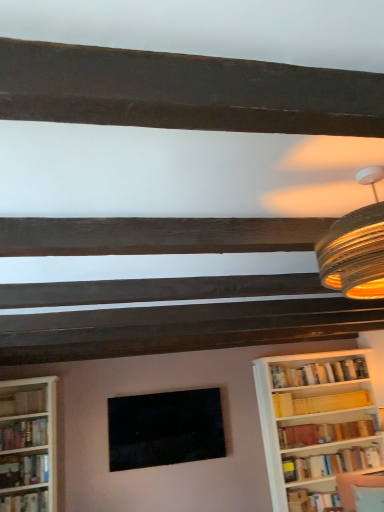
Question: From the image's perspective, is hardcover book at lower right, which appears as the third book when viewed from the right, located above or below hardcover book at left, positioned as the 6th book in right-to-left order?

Choices:
 (A) below
 (B) above

Answer: (A)

Question: Would you say hardcover book at lower right, the 5th book from the left, is inside or outside hardcover book at left, which ranks as the second book in left-to-right order?

Choices:
 (A) inside
 (B) outside

Answer: (B)

Question: Which is nearer to the hardcover book at left, which ranks as the second book in left-to-right order?

Choices:
 (A) hardcover book at lower right, which appears as the third book when viewed from the right
 (B) white wood bookcase at left
 (C) matte yellow bookshelf at right, which is the 6th book from left to right
 (D) hardcover book at right, positioned as the 7th book in left-to-right order
 (E) velvet fabric swivel chair at lower right

Answer: (B)

Question: Based on their relative distances, which object is farther from the matte yellow bookshelf at right, marked as the 2th book in a right-to-left arrangement?

Choices:
 (A) hardcover book at right, positioned as the 7th book in left-to-right order
 (B) hardcover book at lower right, the 5th book from the left
 (C) hardcover book at left, positioned as the 6th book in right-to-left order
 (D) matte black picture frame at center
 (E) velvet fabric swivel chair at lower right

Answer: (C)